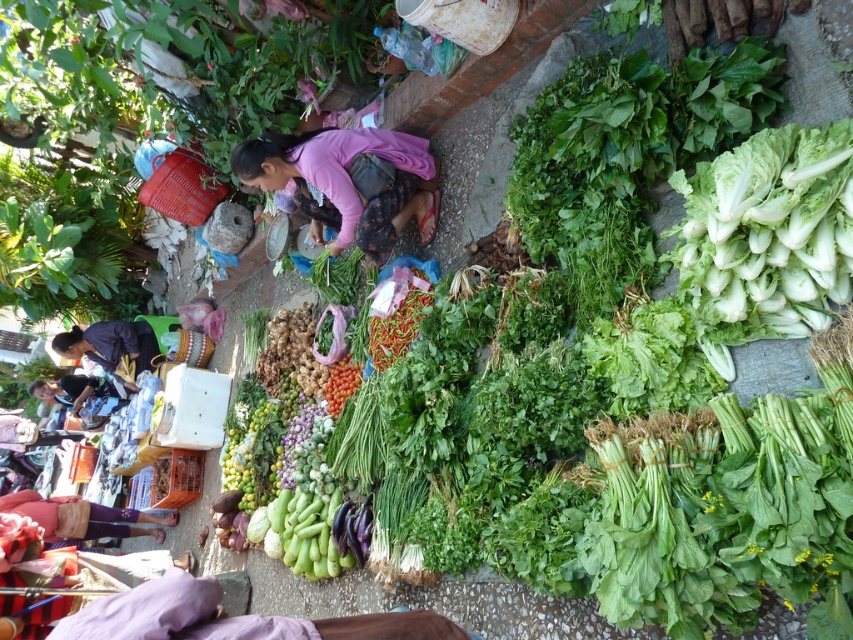
Who is more forward, (x=325, y=209) or (x=44, y=392)?

Point (x=325, y=209) is in front.

Can you confirm if pink fabric at center is bigger than matte black jacket at lower left?

No, pink fabric at center is not bigger than matte black jacket at lower left.

This screenshot has height=640, width=853. In order to click on pink fabric at center in this screenshot , I will do `click(347, 182)`.

Does pink fabric at center appear on the right side of dark blue fabric at lower left?

Indeed, pink fabric at center is positioned on the right side of dark blue fabric at lower left.

Is pink fabric at center above dark blue fabric at lower left?

Yes, pink fabric at center is above dark blue fabric at lower left.

Consider the image. Who is more distant from viewer, (405, 163) or (126, 352)?

Positioned behind is point (126, 352).

This screenshot has height=640, width=853. I want to click on pink fabric at center, so click(x=347, y=182).

Does dark blue fabric at lower left have a greater height compared to matte black jacket at lower left?

Indeed, dark blue fabric at lower left has a greater height compared to matte black jacket at lower left.

Who is more forward, (94,333) or (39,384)?

Point (94,333)

Consider the image. Measure the distance between point (115, 323) and camera.

Point (115, 323) is 6.68 meters from camera.

Where is `dark blue fabric at lower left`? The width and height of the screenshot is (853, 640). dark blue fabric at lower left is located at coordinates (109, 342).